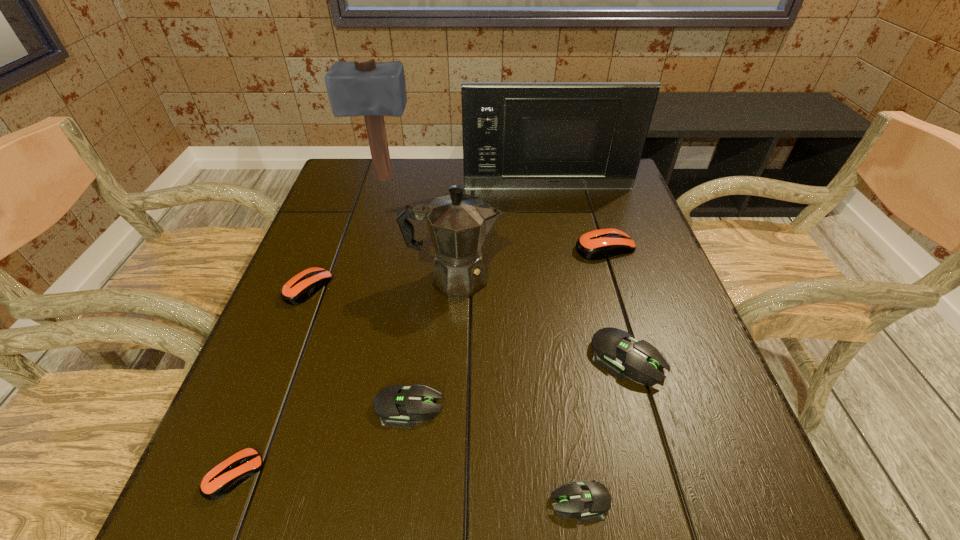
Identify which orange computer mouse is the second nearest to the nearest gray computer mouse. Please provide its 2D coordinates. Your answer should be formatted as a tuple, i.e. [(x, y)], where the tuple contains the x and y coordinates of a point satisfying the conditions above.

[(599, 244)]

Locate an element on the screen. This screenshot has width=960, height=540. gray computer mouse that is the second closest to the second gray computer mouse from left to right is located at coordinates (395, 405).

I want to click on gray computer mouse that can be found as the second closest to the leftmost gray computer mouse, so click(615, 350).